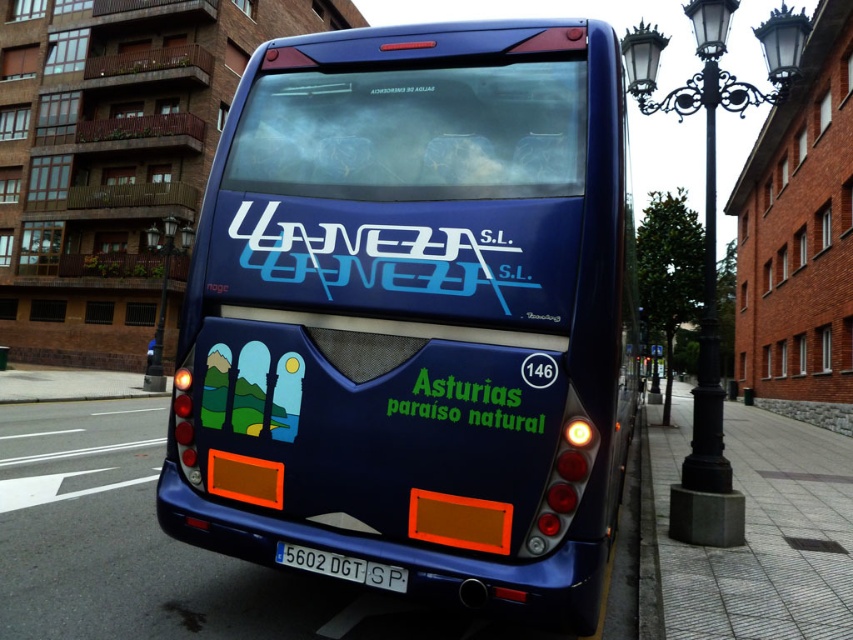
Question: Is black wrought iron streetlight at right to the right of green matte text at center from the viewer's perspective?

Choices:
 (A) yes
 (B) no

Answer: (A)

Question: Where is black wrought iron streetlight at right located in relation to blue plastic license plate at lower center in the image?

Choices:
 (A) right
 (B) left

Answer: (A)

Question: Which point is closer to the camera?

Choices:
 (A) (643, 45)
 (B) (480, 422)
 (C) (305, 305)
 (D) (332, 576)

Answer: (B)

Question: Estimate the real-world distances between objects in this image. Which object is closer to the glossy blue bus at center?

Choices:
 (A) green matte text at center
 (B) black wrought iron streetlight at right
 (C) blue plastic license plate at lower center

Answer: (C)

Question: Does glossy blue bus at center have a smaller size compared to blue plastic license plate at lower center?

Choices:
 (A) yes
 (B) no

Answer: (B)

Question: Which point is farther to the camera?

Choices:
 (A) (421, 381)
 (B) (697, 536)
 (C) (405, 582)

Answer: (B)